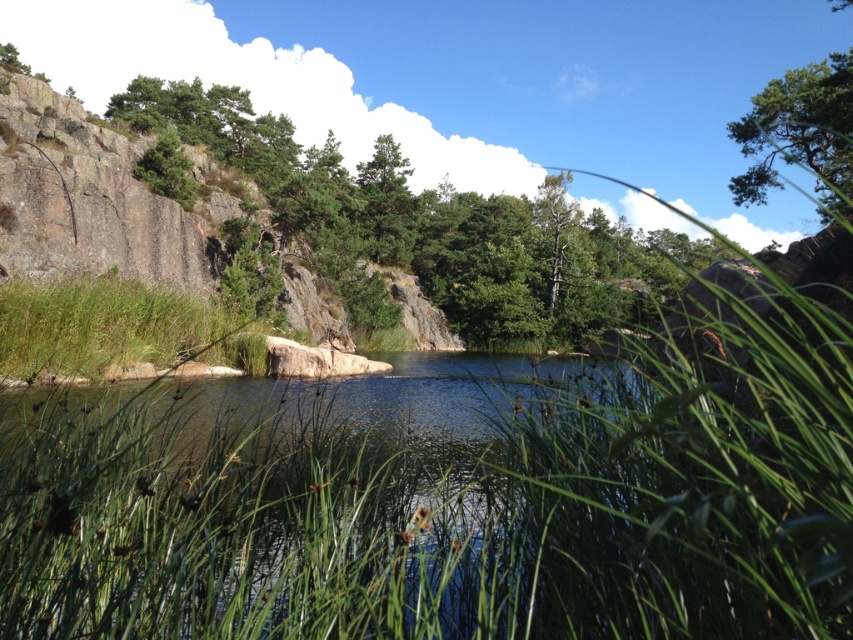
Question: Estimate the real-world distances between objects in this image. Which object is closer to the green textured tree at upper right?

Choices:
 (A) green grass at lower left
 (B) green leafy tree at upper left

Answer: (A)

Question: Can you confirm if green leafy tree at upper left is positioned above green grass at lower left?

Choices:
 (A) no
 (B) yes

Answer: (B)

Question: Among these points, which one is farthest from the camera?

Choices:
 (A) click(x=419, y=525)
 (B) click(x=51, y=268)
 (C) click(x=282, y=172)
 (D) click(x=834, y=150)

Answer: (C)

Question: Among these points, which one is farthest from the camera?

Choices:
 (A) (111, 259)
 (B) (782, 154)
 (C) (321, 528)
 (D) (579, 256)

Answer: (D)

Question: From the image, what is the correct spatial relationship of rocky cliff at left in relation to green textured tree at upper right?

Choices:
 (A) above
 (B) below

Answer: (B)

Question: Can you confirm if green grassy river at center is positioned to the right of green grass at lower left?

Choices:
 (A) yes
 (B) no

Answer: (A)